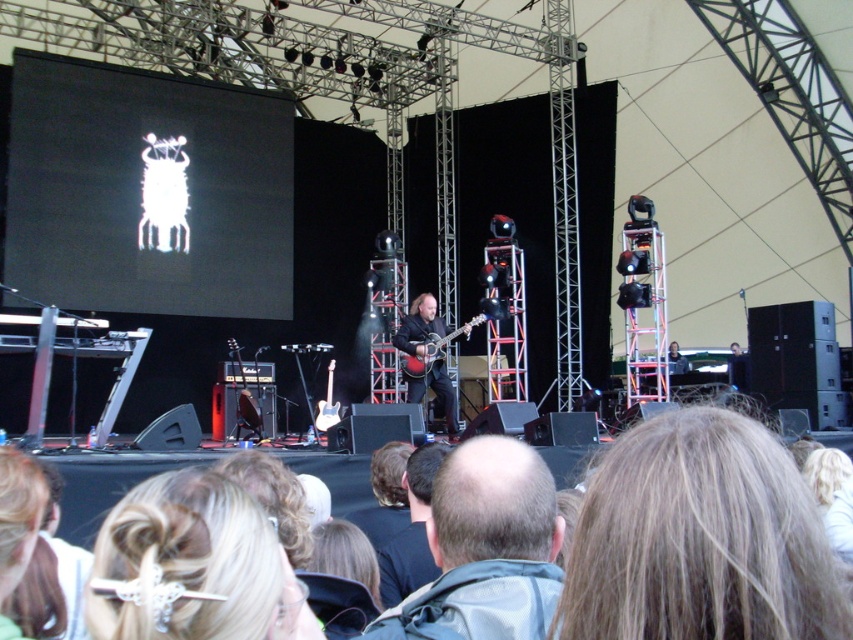
Question: Is blonde hair at lower center further to the viewer compared to light brown hair at center?

Choices:
 (A) no
 (B) yes

Answer: (A)

Question: Is blonde hair at lower center positioned before acoustic guitar at center?

Choices:
 (A) yes
 (B) no

Answer: (A)

Question: Considering the relative positions of blonde hair at lower center and acoustic guitar at center in the image provided, where is blonde hair at lower center located with respect to acoustic guitar at center?

Choices:
 (A) above
 (B) below

Answer: (B)

Question: Estimate the real-world distances between objects in this image. Which object is closer to the acoustic guitar at center?

Choices:
 (A) light brown hair at center
 (B) dark brown leather jacket at center
 (C) blonde hair at lower center

Answer: (B)

Question: Which of the following is the farthest from the observer?

Choices:
 (A) acoustic guitar at center
 (B) blonde hair at lower center
 (C) light brown hair at center

Answer: (A)

Question: Which of the following is the closest to the observer?

Choices:
 (A) (398, 538)
 (B) (479, 600)
 (C) (740, 582)
 (D) (431, 355)

Answer: (C)